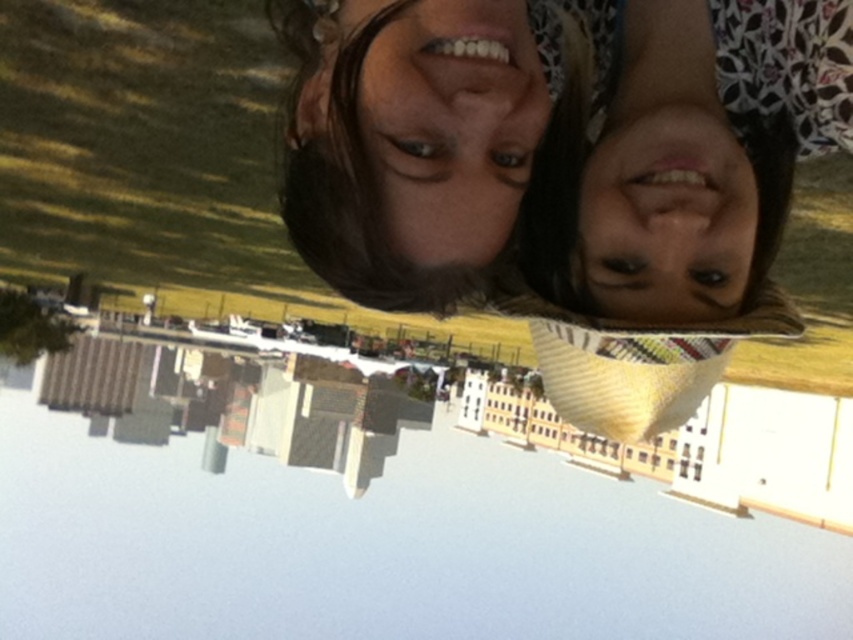
Is point (434, 598) less distant than point (440, 134)?

No, it is behind (440, 134).

Which is below, white glossy lake at center or matte black hair at center?

white glossy lake at center

Which is behind, point (466, 486) or point (694, 264)?

Positioned behind is point (466, 486).

Identify the location of white glossy lake at center. (351, 520).